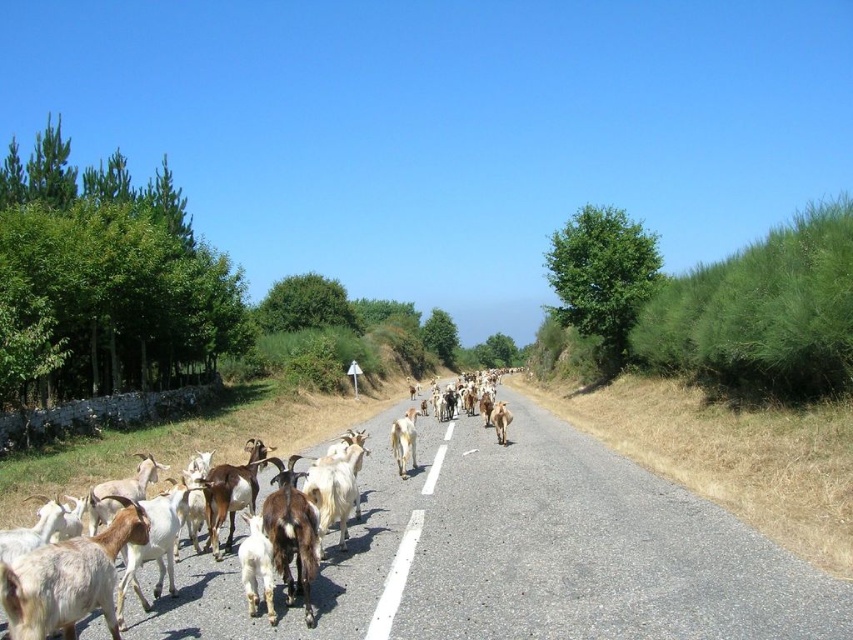
Question: Considering the real-world distances, which object is farthest from the white woolen goat at center?

Choices:
 (A) white woolen goat at lower left
 (B) asphalt road at center

Answer: (A)

Question: Which point is closer to the camera?

Choices:
 (A) (415, 438)
 (B) (428, 461)
 (C) (656, 492)
 (D) (0, 584)

Answer: (D)

Question: Is asphalt road at center behind white woolen goat at lower left?

Choices:
 (A) no
 (B) yes

Answer: (B)

Question: Does asphalt road at center appear over white woolen goats at center?

Choices:
 (A) no
 (B) yes

Answer: (B)

Question: Among these points, which one is farthest from the camera?

Choices:
 (A) (65, 621)
 (B) (242, 616)
 (C) (392, 424)

Answer: (C)

Question: Where is white woolen goat at lower left located in relation to white woolen goat at center in the image?

Choices:
 (A) below
 (B) above

Answer: (B)